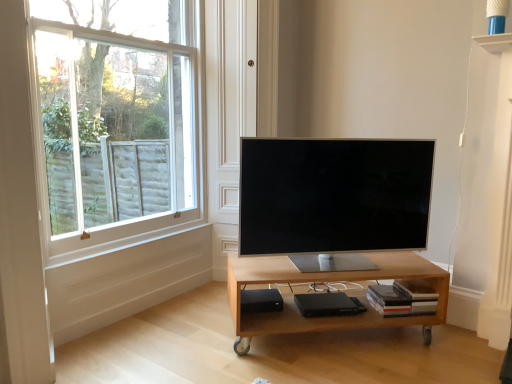
Identify the location of empty space that is ontop of black matte speaker at lower center (from a real-world perspective). The image size is (512, 384). (258, 299).